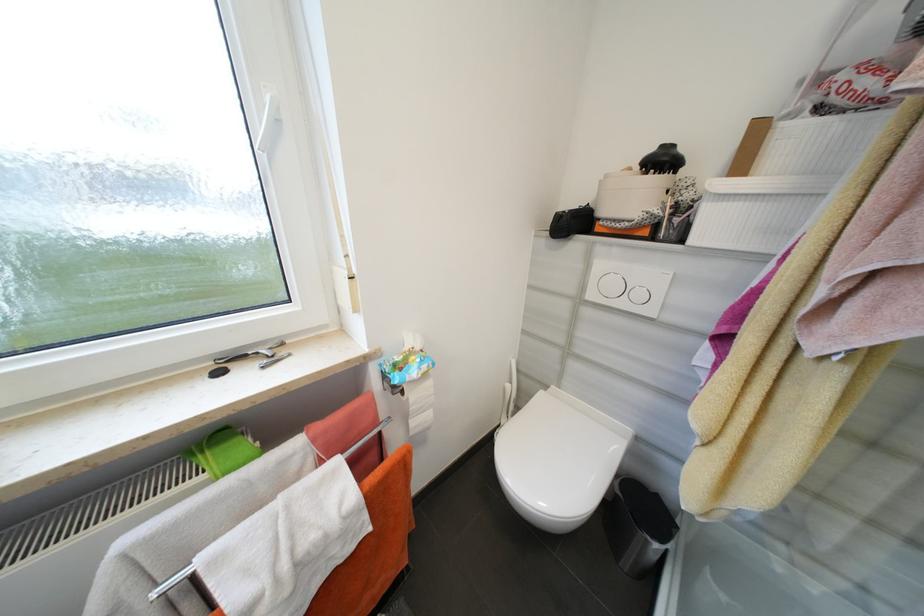
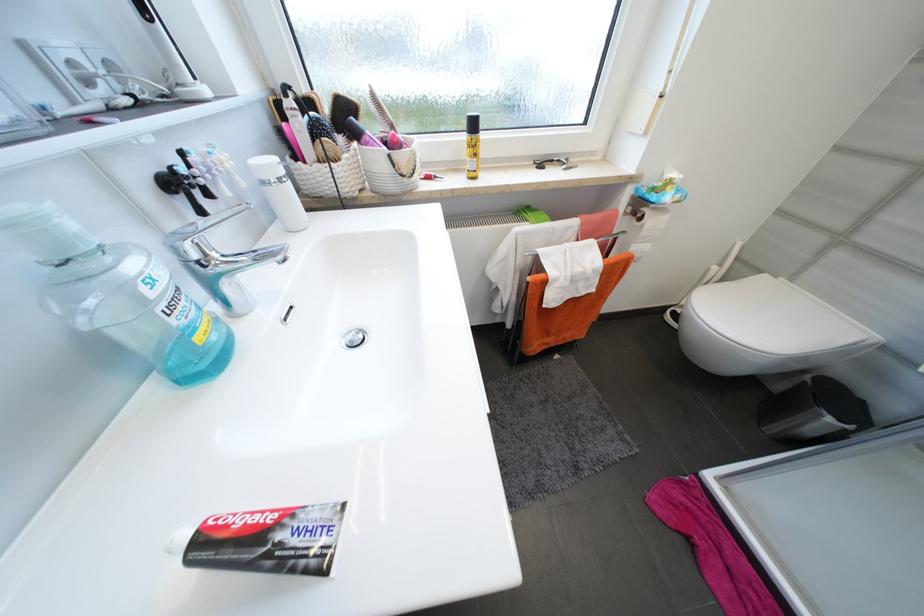
First-person continuous shooting, in which direction is the camera rotating?

The rotation direction of the camera is left-down.